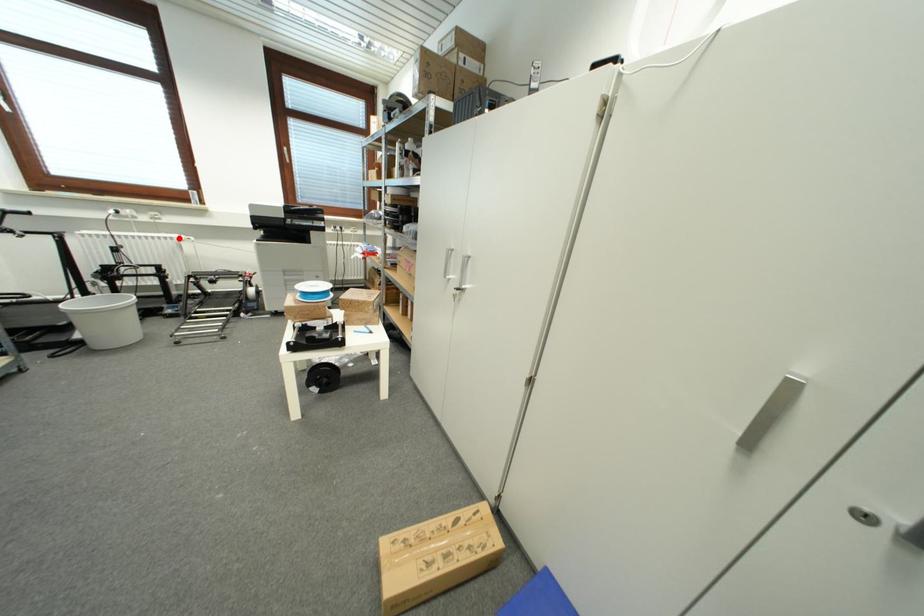
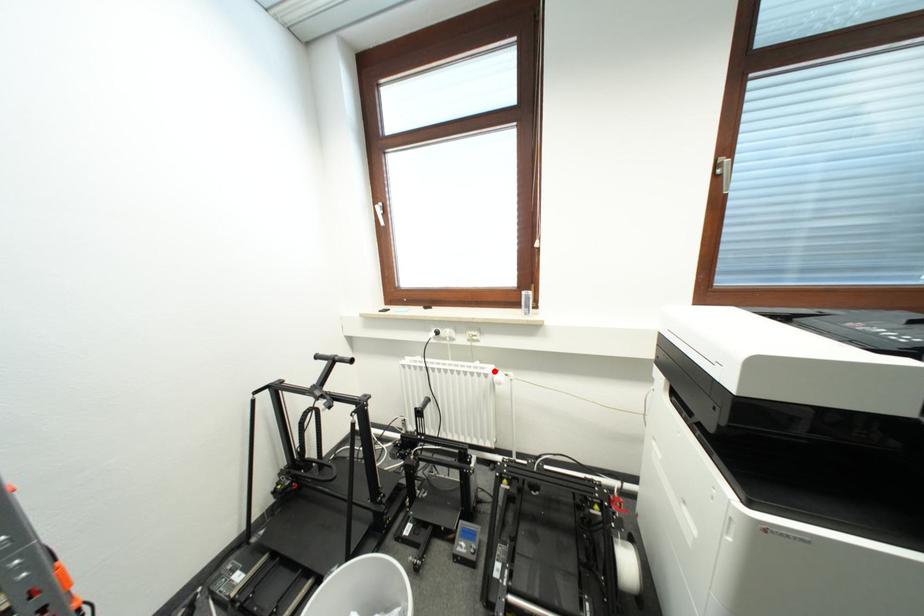
Consider the image. I am providing you with two images of the same scene from different viewpoints. A red point is marked on the first image and another point is marked on the second image. Are the points marked in image1 and image2 representing the same 3D position?

Yes